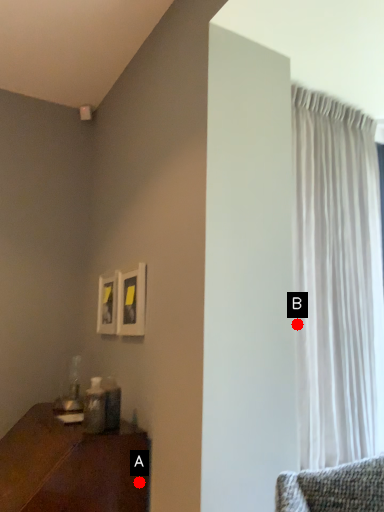
Question: Two points are circled on the image, labeled by A and B beside each circle. Among these points, which one is nearest to the camera?

Choices:
 (A) A is closer
 (B) B is closer

Answer: (A)